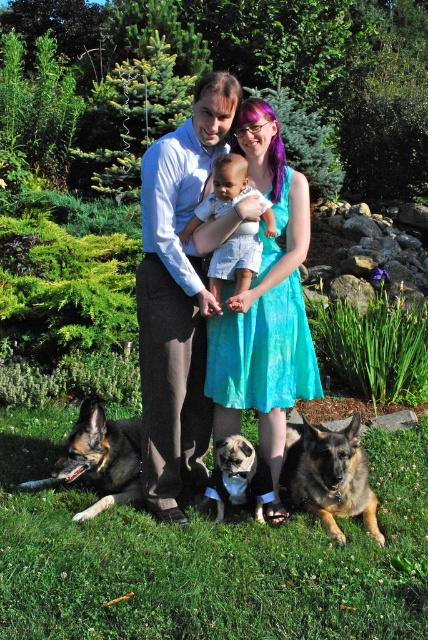
In the scene shown: You are a photographer taking a picture of the pug at center and the light blue shirt at center. Which one is positioned higher in the image?

The light blue shirt at center is located above the pug at center, so it is positioned higher in the image.

You are taking a photo of the family portrait and need to adjust your focus. Which point should you focus on first, point (297, 472) or point (258, 460)?

Point (297, 472) is further to the camera than point (258, 460), so you should focus on point (297, 472) first since it is closer to the camera.

You are standing in front of the family portrait and notice two subjects at the center of the image. One is a pug at center and the other is a light blue shirt at center. Which one appears closer to you?

The light blue shirt at center is closer to the viewer than the pug at center.